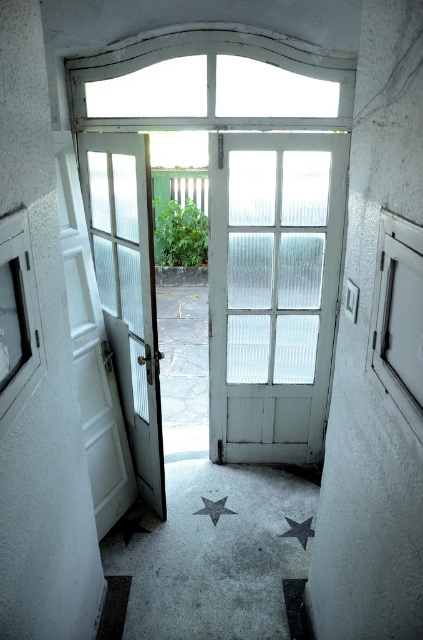
Who is shorter, white frosted glass door at center or transparent glass window at right?

transparent glass window at right

Based on the photo, how distant is white frosted glass door at center from transparent glass window at right?

white frosted glass door at center is 5.70 feet away from transparent glass window at right.

Which is in front, point (304, 141) or point (384, 353)?

Point (384, 353)

The height and width of the screenshot is (640, 423). What are the coordinates of `white frosted glass door at center` in the screenshot? It's located at 272,292.

Can you confirm if transparent glass window at right is positioned below metallic gray star at center?

Actually, transparent glass window at right is above metallic gray star at center.

Which of these two, transparent glass window at right or metallic gray star at center, stands shorter?

Standing shorter between the two is metallic gray star at center.

Does point (387, 355) come behind point (307, 540)?

No.

In order to click on transparent glass window at right in this screenshot , I will do `click(398, 316)`.

Is metallic gray star at center positioned at the back of metallic silver star at center?

No, metallic gray star at center is in front of metallic silver star at center.

Which is behind, point (288, 522) or point (208, 509)?

Positioned behind is point (208, 509).

Is point (286, 532) positioned in front of point (224, 500)?

Yes, point (286, 532) is in front of point (224, 500).

Identify the location of metallic gray star at center. (299, 531).